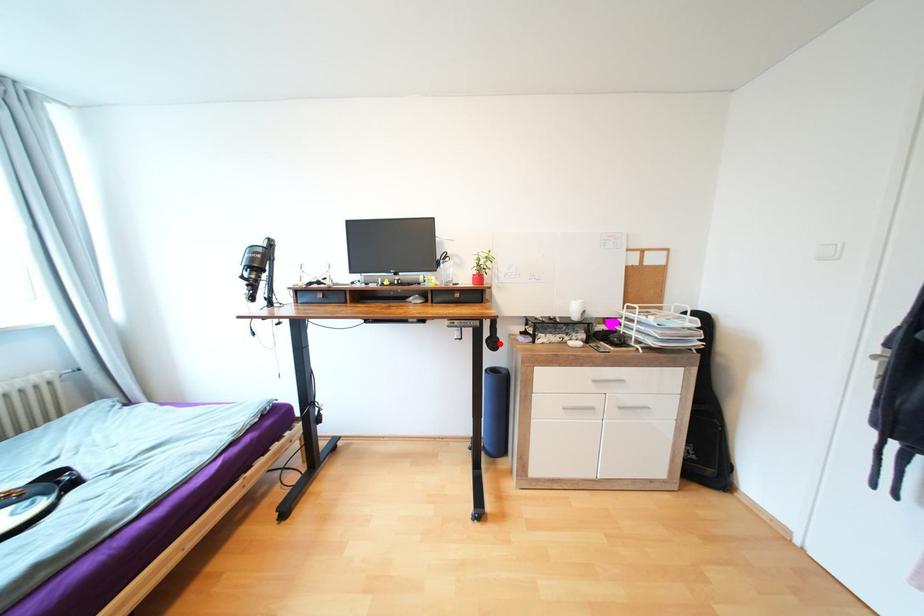
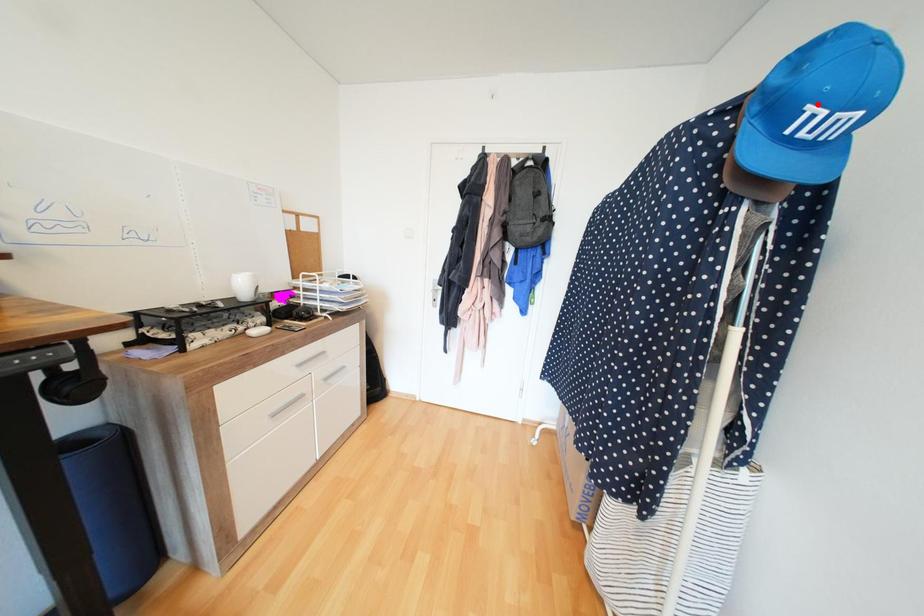
Based on the photo, I am providing you with two images of the same scene from different viewpoints. A red point is marked on the first image and another point is marked on the second image. Are the points marked in image1 and image2 representing the same 3D position?

No